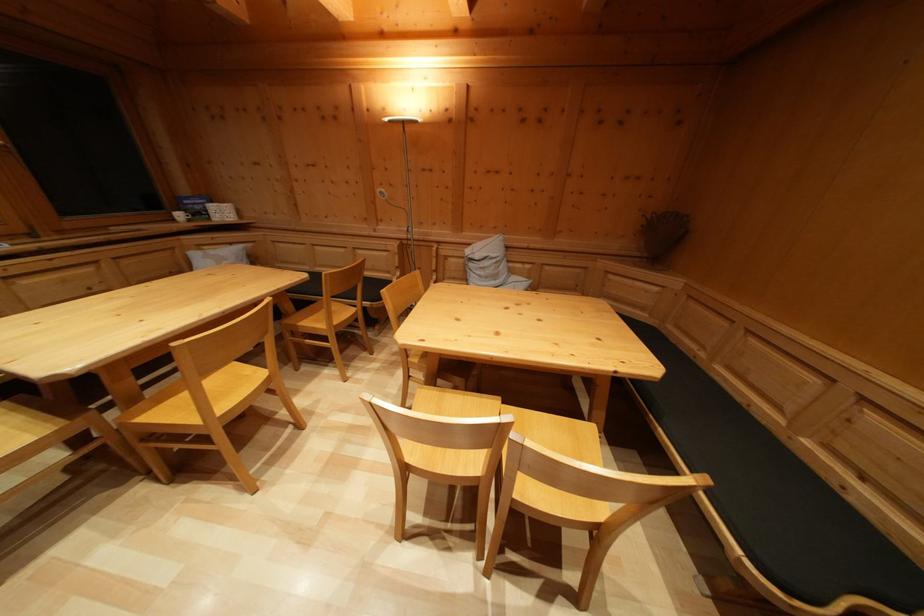
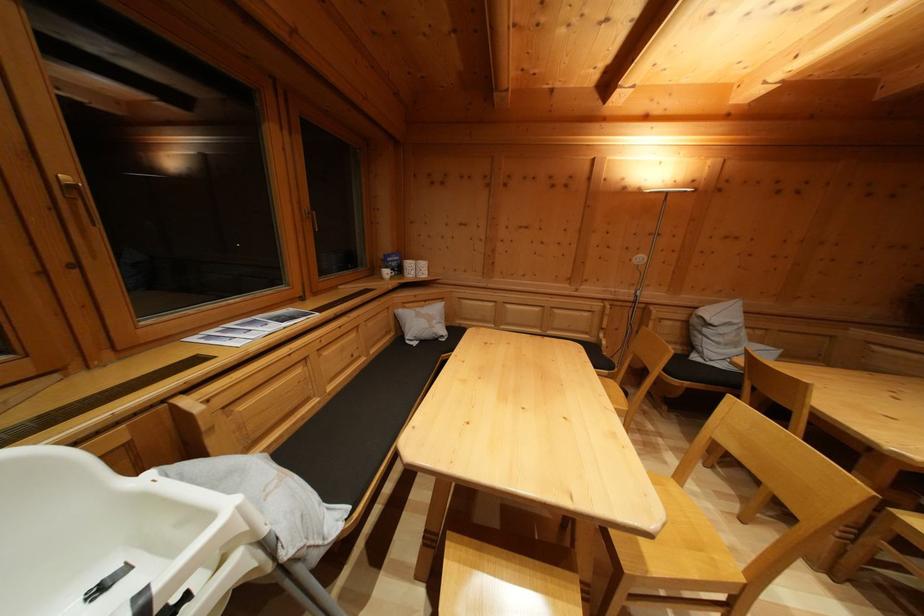
Question: Which direction would the cameraman need to move to produce the second image? Reply with the corresponding letter.

Choices:
 (A) Left
 (B) Right
 (C) Forward
 (D) Backward

Answer: (A)